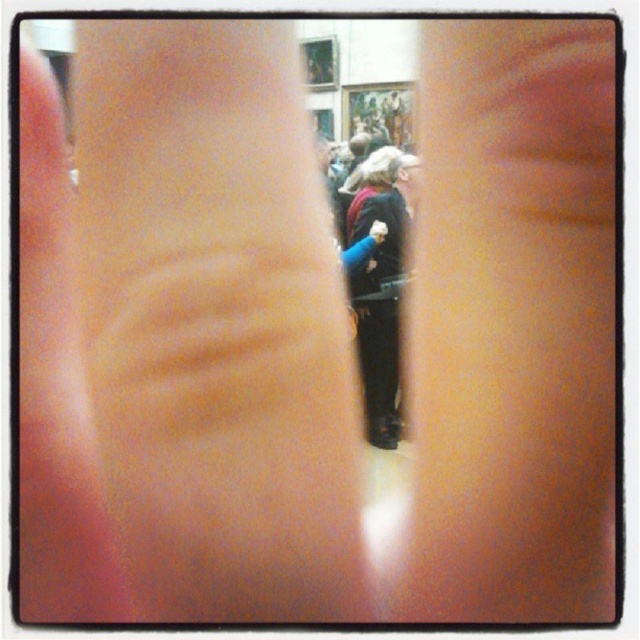
Is point (524, 54) closer to camera compared to point (392, 148)?

Yes, point (524, 54) is closer to viewer.

Which is in front, point (406, 356) or point (397, 227)?

Point (406, 356) is in front.

This screenshot has width=640, height=640. What are the coordinates of `smooth skin hand at center` in the screenshot? It's located at 512,324.

Can you confirm if smooth skin hand at center is shorter than pink matte skin at center?

In fact, smooth skin hand at center may be taller than pink matte skin at center.

Does smooth skin hand at center have a lesser width compared to pink matte skin at center?

In fact, smooth skin hand at center might be wider than pink matte skin at center.

Who is more distant from viewer, (611, 586) or (40, 292)?

Positioned behind is point (40, 292).

This screenshot has width=640, height=640. Find the location of `smooth skin hand at center`. smooth skin hand at center is located at coordinates (512, 324).

The image size is (640, 640). Describe the element at coordinates (216, 324) in the screenshot. I see `pink smooth skin at center` at that location.

Between pink smooth skin at center and pink matte skin at center, which one appears on the left side from the viewer's perspective?

From the viewer's perspective, pink matte skin at center appears more on the left side.

Is point (145, 598) less distant than point (42, 428)?

Yes, it is in front of point (42, 428).

Locate an element on the screen. This screenshot has height=640, width=640. pink smooth skin at center is located at coordinates (216, 324).